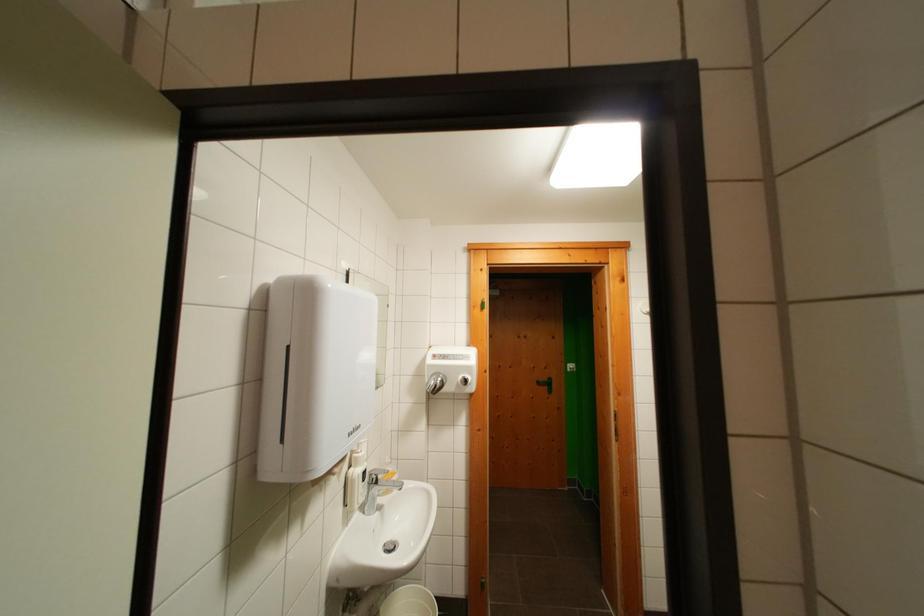
The image size is (924, 616). Identify the location of black door handle. (545, 384).